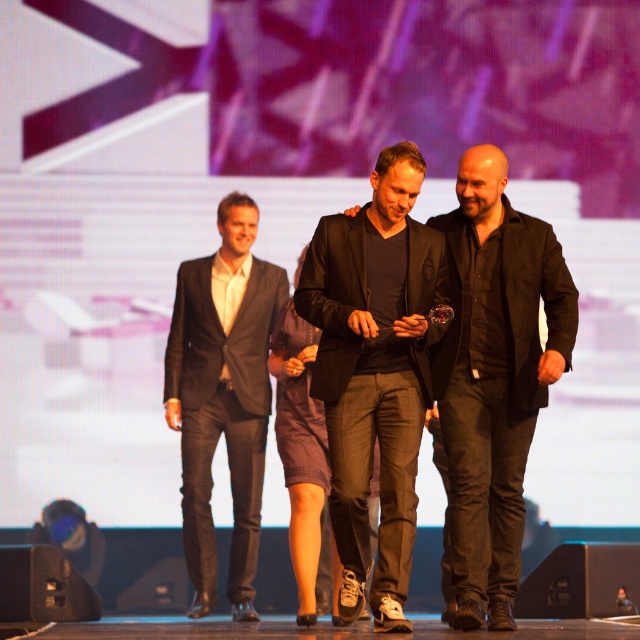
Question: Estimate the real-world distances between objects in this image. Which object is farther from the black matte suit at center?

Choices:
 (A) dark gray suit at left
 (B) black matte jacket at center

Answer: (A)

Question: Which of the following is the closest to the observer?

Choices:
 (A) (164, 384)
 (B) (355, 589)
 (C) (480, 188)

Answer: (C)

Question: Can you confirm if black matte jacket at center is wider than dark gray suit at left?

Choices:
 (A) yes
 (B) no

Answer: (B)

Question: Which is nearer to the dark gray suit at left?

Choices:
 (A) black matte suit at center
 (B) black matte jacket at center

Answer: (A)

Question: Is black matte jacket at center thinner than dark gray suit at left?

Choices:
 (A) no
 (B) yes

Answer: (B)

Question: Does black matte suit at center have a lesser width compared to black matte jacket at center?

Choices:
 (A) yes
 (B) no

Answer: (B)